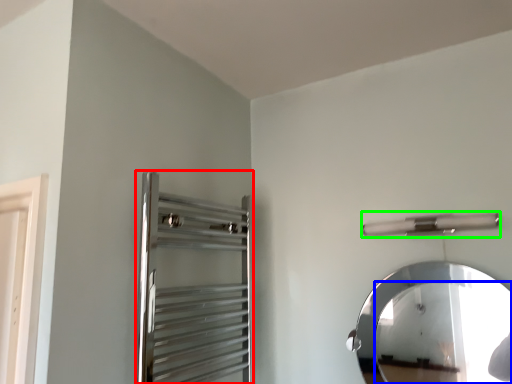
Question: Estimate the real-world distances between objects in this image. Which object is closer to screen door (highlighted by a red box), mirror (highlighted by a blue box) or towel bar (highlighted by a green box)?

Choices:
 (A) mirror
 (B) towel bar

Answer: (B)